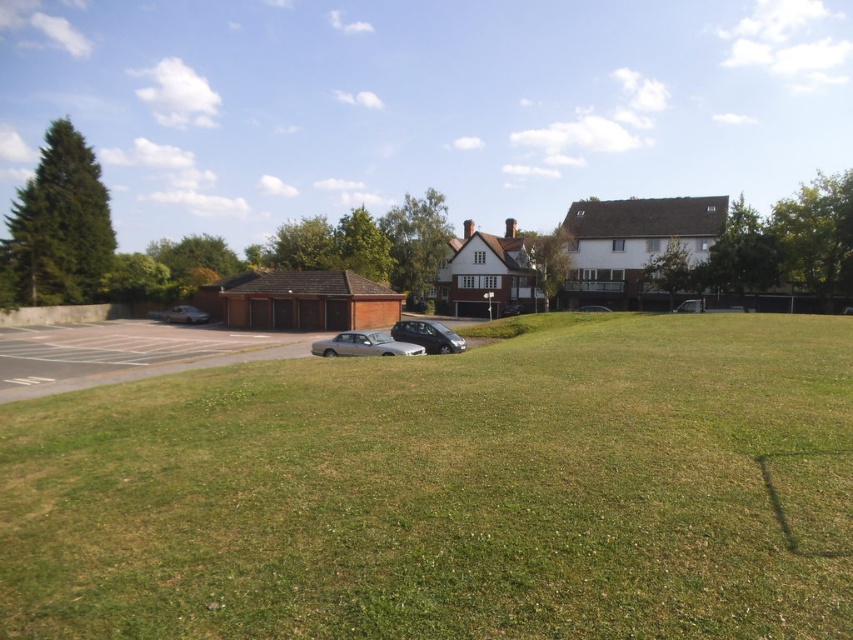
Question: From the image, what is the correct spatial relationship of silver metallic car at center in relation to metallic silver car at left?

Choices:
 (A) below
 (B) above

Answer: (A)

Question: Observing the image, what is the correct spatial positioning of green grass at lower center in reference to metallic silver car at center?

Choices:
 (A) left
 (B) right

Answer: (A)

Question: Can you confirm if silver metallic car at center is bigger than satin silver car at center?

Choices:
 (A) no
 (B) yes

Answer: (A)

Question: Among these points, which one is farthest from the camera?

Choices:
 (A) (189, 317)
 (B) (424, 337)
 (C) (314, 346)

Answer: (A)

Question: Which point appears closest to the camera in this image?

Choices:
 (A) (170, 316)
 (B) (572, 467)
 (C) (415, 332)

Answer: (B)

Question: Which point appears closest to the camera in this image?

Choices:
 (A) (161, 314)
 (B) (525, 472)

Answer: (B)